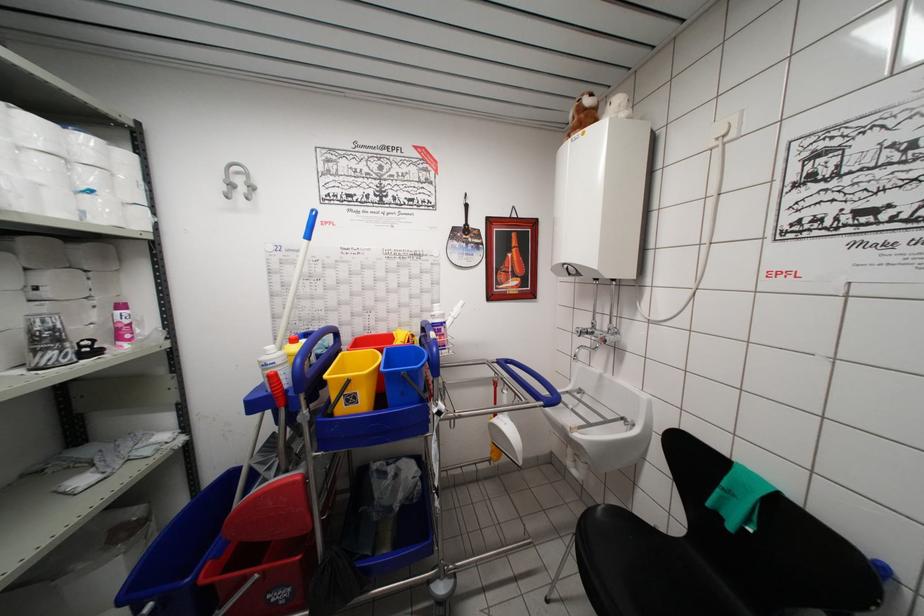
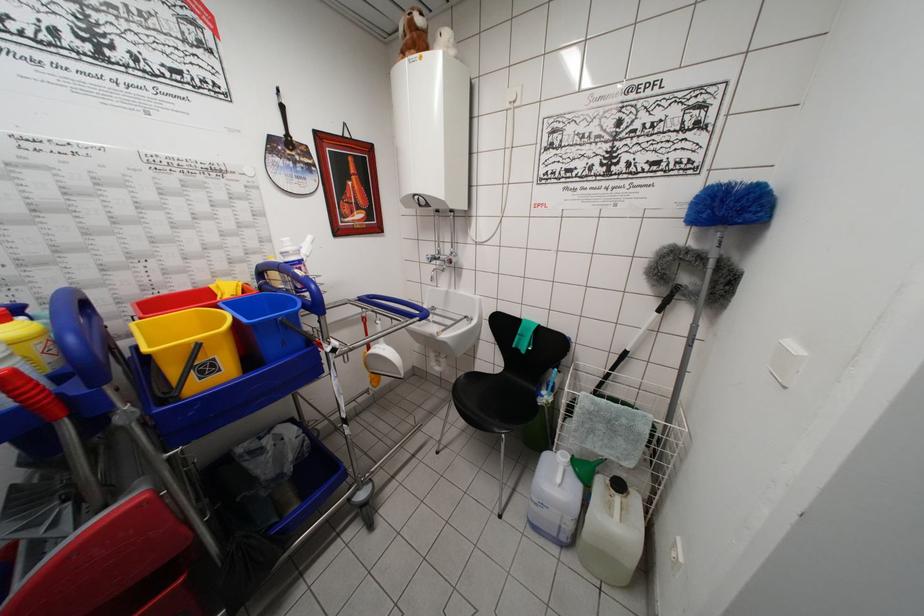
The point at (655, 530) is marked in the first image. Where is the corresponding point in the second image?

(491, 379)